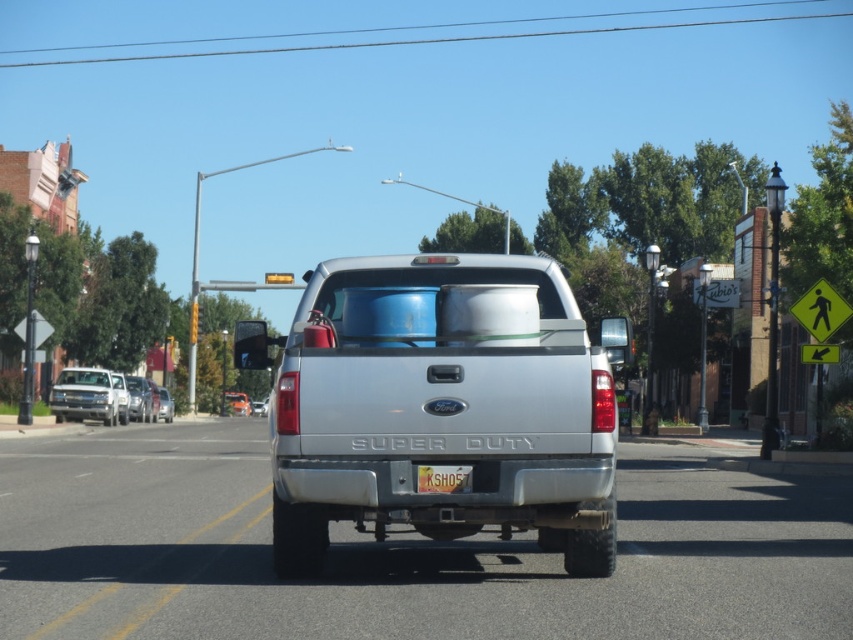
Question: Can you confirm if yellow reflective pedestrian crossing sign at right is positioned above metallic silver truck at center?

Choices:
 (A) no
 (B) yes

Answer: (B)

Question: Based on their relative distances, which object is nearer to the metallic silver truck at center?

Choices:
 (A) yellow matte license plate at center
 (B) yellow reflective pedestrian crossing sign at right
 (C) silver metallic truck at center
 (D) silver metallic sedan at center

Answer: (D)

Question: Which point appears farthest from the camera in this image?

Choices:
 (A) (167, 401)
 (B) (374, 323)
 (C) (71, 372)

Answer: (A)

Question: Does yellow matte license plate at center appear under metallic silver truck at center?

Choices:
 (A) no
 (B) yes

Answer: (A)

Question: Is silver metallic truck at center smaller than yellow matte license plate at center?

Choices:
 (A) yes
 (B) no

Answer: (B)

Question: Considering the real-world distances, which object is farthest from the satin silver sedan at center?

Choices:
 (A) yellow reflective pedestrian crossing sign at right
 (B) silver metallic sedan at center
 (C) metallic silver truck at center

Answer: (A)